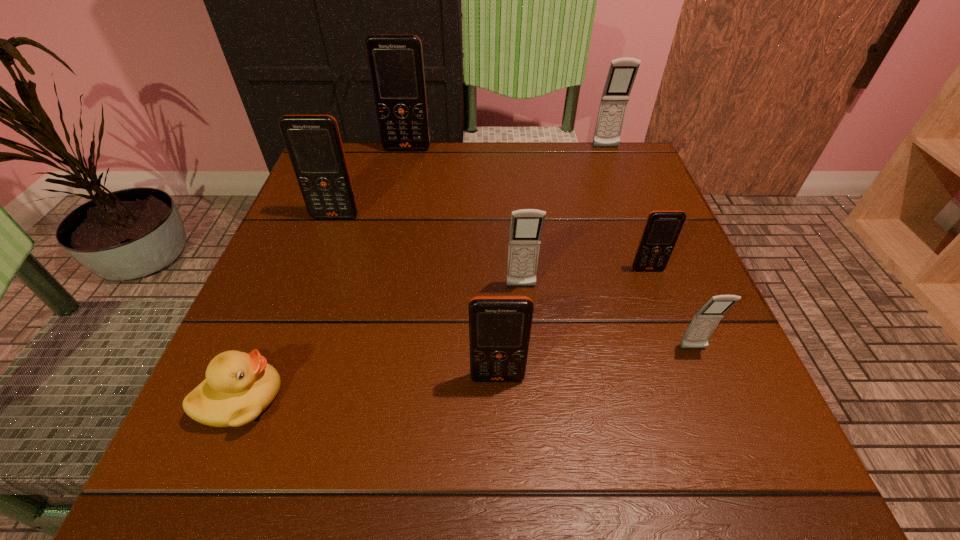
Image resolution: width=960 pixels, height=540 pixels. Find the location of `vacant space at the left edge of the desktop`. vacant space at the left edge of the desktop is located at coordinates (315, 230).

The image size is (960, 540). Identify the location of free space at the right edge. (659, 320).

At what (x,y) coordinates should I click in order to perform the action: click on vacant space at the far left corner of the desktop. Please return your answer as a coordinate pair (x, y). Looking at the image, I should click on (361, 177).

Identify the location of free space at the far right corner. The image size is (960, 540). (603, 153).

Find the location of a particular element. Image resolution: width=960 pixels, height=540 pixels. vacant space at the near right corner is located at coordinates (687, 433).

The width and height of the screenshot is (960, 540). What are the coordinates of `empty space that is in between the yellow duckling and the leftmost orange cellular telephone` in the screenshot? It's located at (289, 307).

Where is `empty location between the farthest gray cellular telephone and the leftmost gray cellular telephone`? Image resolution: width=960 pixels, height=540 pixels. empty location between the farthest gray cellular telephone and the leftmost gray cellular telephone is located at coordinates (564, 217).

Identify the location of vacant space that is in between the sixth nearest object and the duckling. (289, 307).

Where is `vacant space that's between the nearest cellular telephone and the fourth farthest cellular telephone`? vacant space that's between the nearest cellular telephone and the fourth farthest cellular telephone is located at coordinates (572, 323).

Where is `blank region between the smallest gray cellular telephone and the third orange cellular telephone from left to right`? blank region between the smallest gray cellular telephone and the third orange cellular telephone from left to right is located at coordinates (595, 363).